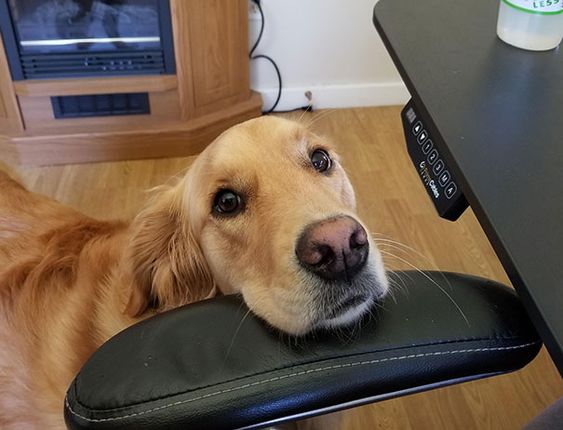
Image resolution: width=563 pixels, height=430 pixels. Find the location of `wall`. wall is located at coordinates (318, 39).